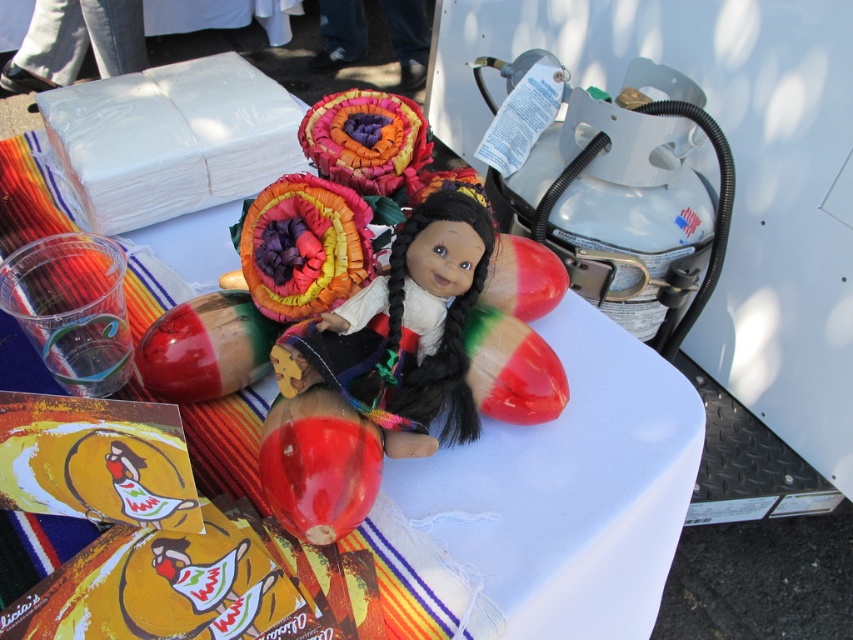
You are setting up a table for a cultural event and need to place the matte plastic doll at center on the white glossy table at center. Can the doll fit on the table?

The white glossy table at center is larger in size than the matte plastic doll at center, so yes, the doll can fit on the table.

You are setting up a display and need to place a small vase that is 3 inches wide between the white glossy table at center and the matte plastic doll at center. Is there enough space between them to fit the vase?

The distance between the white glossy table at center and the matte plastic doll at center is 8.50 inches. Since the vase is 3 inches wide, there is sufficient space to place it between them.

Looking at this image, you are setting up a display table for a cultural event. You have a white glossy table at center and a matte plastic doll at center. Which object is taller?

The white glossy table at center is taller than the matte plastic doll at center.